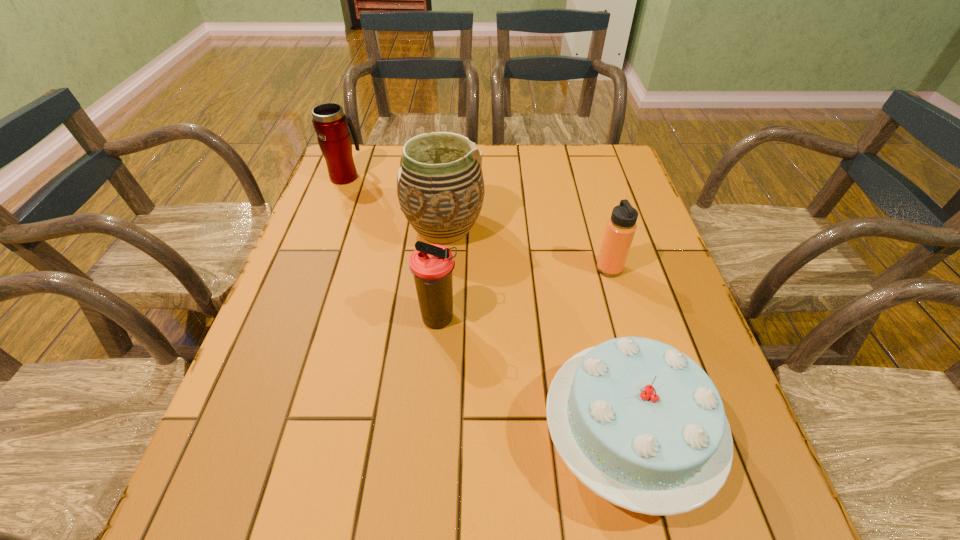
You are a GUI agent. You are given a task and a screenshot of the screen. Output one action in this format:
    pyautogui.click(x=<x>, y=<y>)
    Task: Click on the object that is at the far left corner
    
    Given the screenshot: What is the action you would take?
    pyautogui.click(x=331, y=125)

Where is `object that is at the near right corner`? object that is at the near right corner is located at coordinates (641, 424).

Find the location of a particular element. This screenshot has height=540, width=960. blank space at the near edge of the desktop is located at coordinates (653, 521).

The width and height of the screenshot is (960, 540). In the image, there is a desktop. What are the coordinates of `vacant space at the left edge` in the screenshot? It's located at (311, 316).

What are the coordinates of `vacant space at the right edge of the desktop` in the screenshot? It's located at (592, 188).

The image size is (960, 540). Identify the location of free space at the far left corner of the desktop. (357, 165).

The height and width of the screenshot is (540, 960). Identify the location of free space at the far right corner of the desktop. (587, 165).

Locate an element on the screen. The image size is (960, 540). unoccupied area between the second farthest thermos bottle and the leftmost object is located at coordinates (477, 222).

The height and width of the screenshot is (540, 960). I want to click on blank region between the rightmost thermos bottle and the second thermos bottle from right to left, so click(524, 294).

The width and height of the screenshot is (960, 540). Identify the location of free space between the pottery and the second nearest thermos bottle. (527, 248).